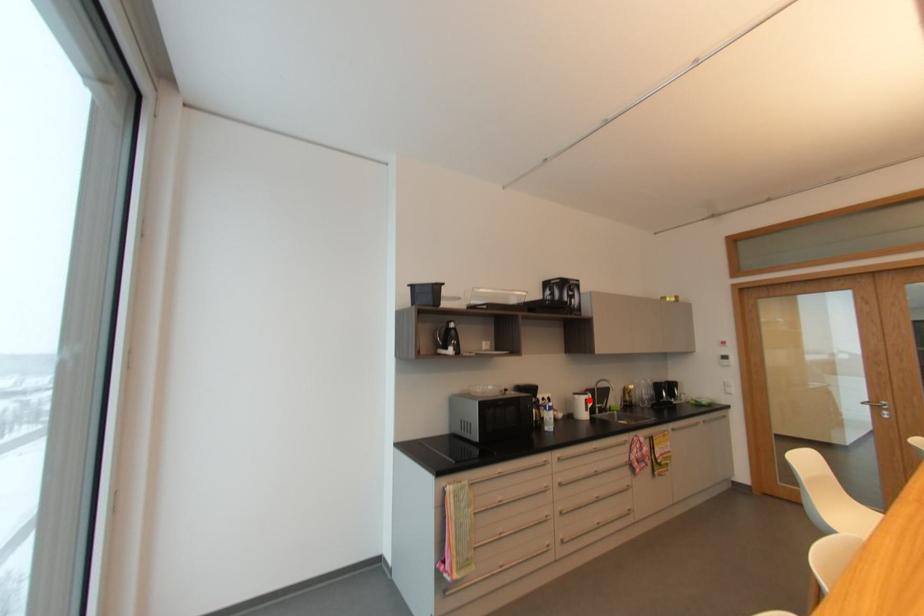
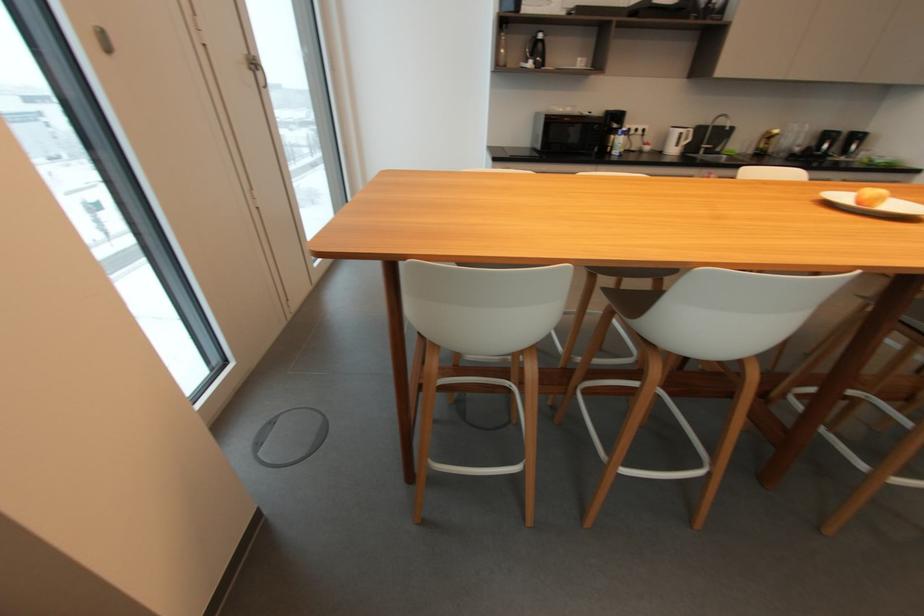
Question: I am providing you with two images of the same scene from different viewpoints. Given a red point in image1, look at the same physical point in image2. Is it:

Choices:
 (A) Closer to the viewpoint
 (B) Farther from the viewpoint

Answer: (A)